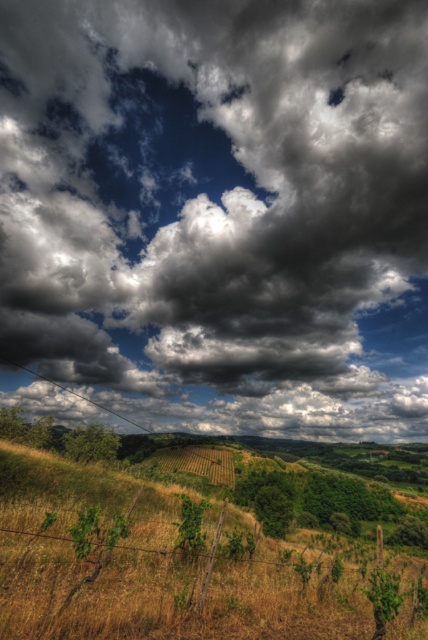
Can you confirm if dark gray cloud at upper center is positioned above green grassy field at center?

Yes, dark gray cloud at upper center is above green grassy field at center.

Who is positioned more to the right, dark gray cloud at upper center or green grassy field at center?

Positioned to the right is dark gray cloud at upper center.

Locate an element on the screen. The width and height of the screenshot is (428, 640). dark gray cloud at upper center is located at coordinates (219, 211).